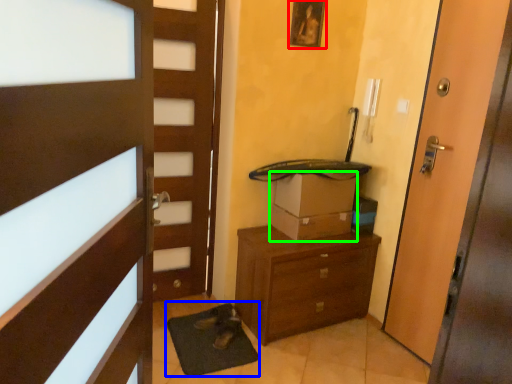
Question: Considering the real-world distances, which object is farthest from picture frame (highlighted by a red box)? bath mat (highlighted by a blue box) or cardboard box (highlighted by a green box)?

Choices:
 (A) bath mat
 (B) cardboard box

Answer: (A)